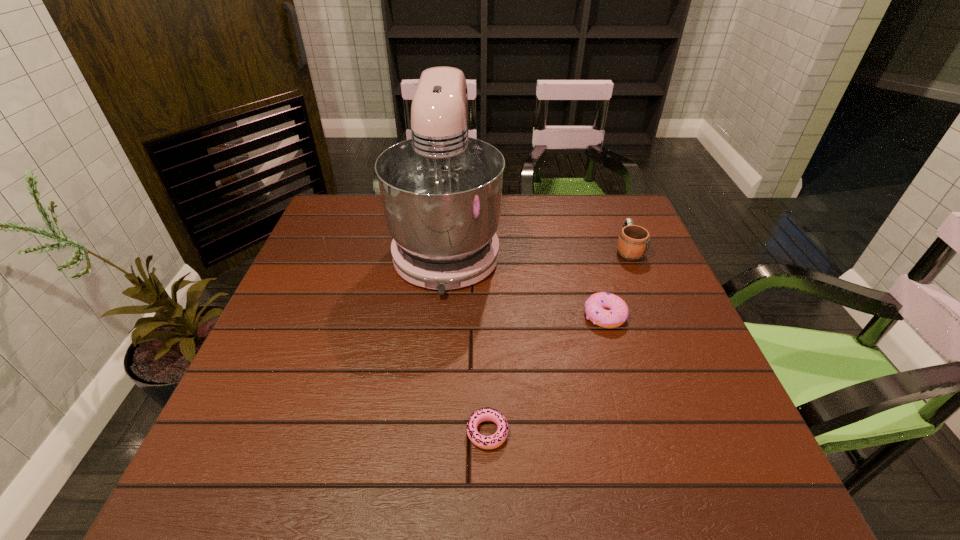
I want to click on free region located 0.190m on the side of the mug with the handle, so click(609, 203).

Locate an element on the screen. vacant space situated on the back of the farther doughnut is located at coordinates (582, 237).

Find the location of a particular element. blank space located on the right of the shortest object is located at coordinates (654, 432).

You are a GUI agent. You are given a task and a screenshot of the screen. Output one action in this format:
    pyautogui.click(x=<x>, y=<y>)
    Task: Click on the object that is at the far edge
    
    Given the screenshot: What is the action you would take?
    pyautogui.click(x=441, y=191)

Image resolution: width=960 pixels, height=540 pixels. I want to click on mug that is at the right edge, so pos(633,242).

Image resolution: width=960 pixels, height=540 pixels. In order to click on doughnut located in the right edge section of the desktop in this screenshot , I will do `click(617, 312)`.

The height and width of the screenshot is (540, 960). In the image, there is a desktop. Find the location of `vacant space at the far edge`. vacant space at the far edge is located at coordinates (523, 227).

In the image, there is a desktop. Identify the location of vacant space at the near edge. The height and width of the screenshot is (540, 960). (631, 476).

Image resolution: width=960 pixels, height=540 pixels. I want to click on free space at the left edge of the desktop, so click(x=317, y=249).

In the image, there is a desktop. Where is `blank space at the right edge`? The image size is (960, 540). blank space at the right edge is located at coordinates (635, 261).